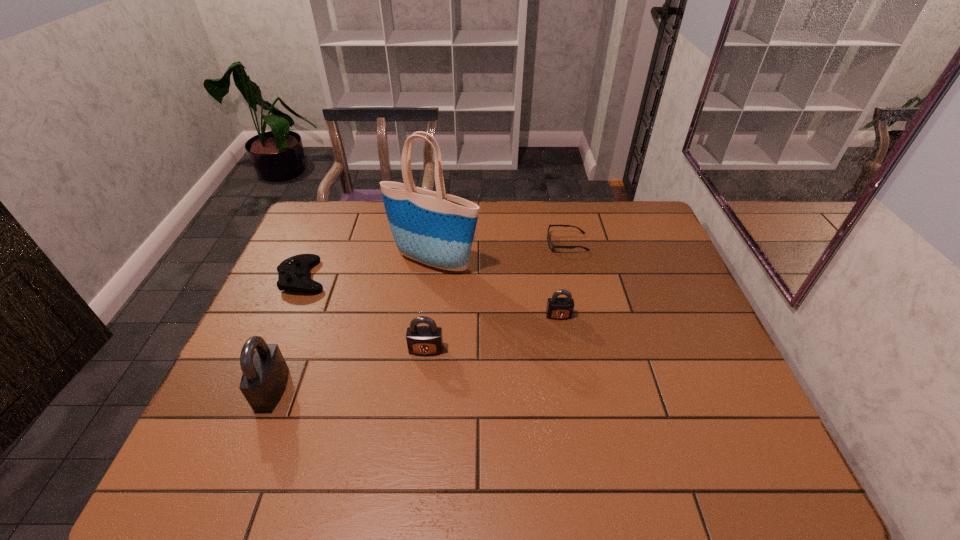
Locate an element on the screen. Image resolution: width=960 pixels, height=540 pixels. object present at the near left corner is located at coordinates (265, 373).

Where is `vacant space at the far edge of the desktop`? This screenshot has height=540, width=960. vacant space at the far edge of the desktop is located at coordinates (484, 227).

You are a GUI agent. You are given a task and a screenshot of the screen. Output one action in this format:
    pyautogui.click(x=<x>, y=<y>)
    Task: Click on the vacant region at the near edge of the desktop
    The image size is (960, 540).
    Given the screenshot: What is the action you would take?
    pyautogui.click(x=282, y=417)

I want to click on vacant region at the left edge of the desktop, so click(x=319, y=242).

In the image, there is a desktop. Where is `vacant space at the right edge`? This screenshot has height=540, width=960. vacant space at the right edge is located at coordinates (664, 269).

Where is `blank space at the far right corner`? blank space at the far right corner is located at coordinates (612, 207).

The width and height of the screenshot is (960, 540). I want to click on free point between the tote bag and the sunglasses, so click(x=500, y=253).

You are a GUI agent. You are given a task and a screenshot of the screen. Output one action in this format:
    pyautogui.click(x=<x>, y=<y>)
    Task: Click on the blank region between the control and the shortest padlock
    
    Given the screenshot: What is the action you would take?
    pyautogui.click(x=431, y=296)

Identify the location of empty location between the tallest object and the farthest padlock. The image size is (960, 540). (496, 289).

I want to click on vacant point located between the tallest object and the rightmost padlock, so click(496, 289).